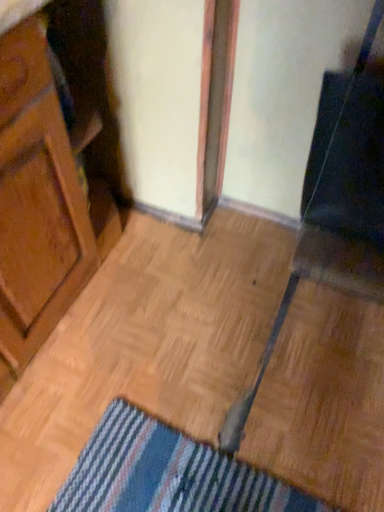
The image size is (384, 512). I want to click on free space to the right of wooden cabinet at left, so click(x=185, y=326).